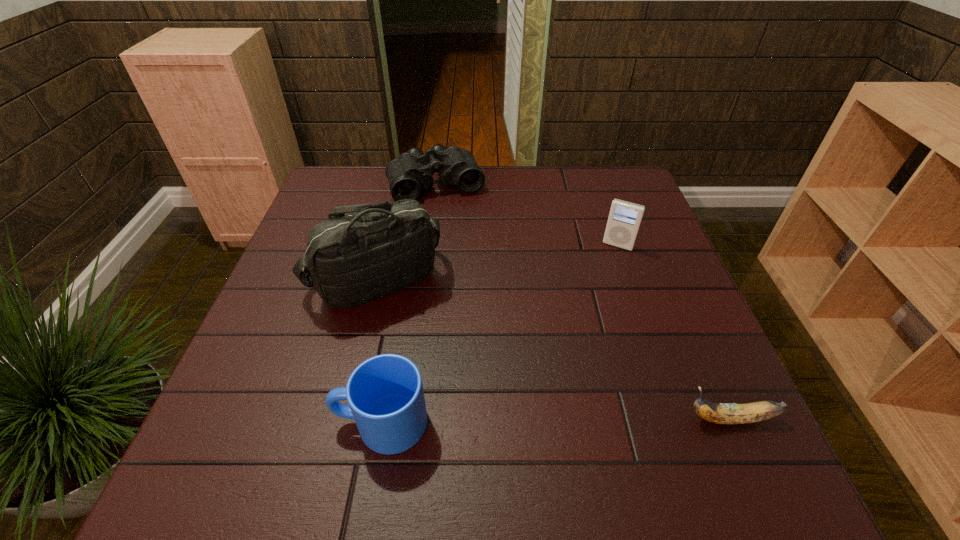
Find the location of a particular element. The image size is (960, 540). mug is located at coordinates (385, 394).

Find the location of a particular element. the shortest object is located at coordinates (720, 413).

The width and height of the screenshot is (960, 540). I want to click on iPod, so click(624, 220).

The height and width of the screenshot is (540, 960). I want to click on the tallest object, so click(363, 252).

Locate an element on the screen. The image size is (960, 540). binoculars is located at coordinates (409, 174).

The image size is (960, 540). Identify the location of vacant space located on the side of the mug with the handle. (214, 422).

Find the location of a particular element. This screenshot has height=540, width=960. free spot located 0.120m on the side of the mug with the handle is located at coordinates (269, 422).

Find the location of `free space located on the side of the mug with the handle`. free space located on the side of the mug with the handle is located at coordinates (219, 422).

At what (x,y) coordinates should I click in order to perform the action: click on vacant space situated 0.390m at the stem of the shortest object. Please return your answer as a coordinate pair (x, y). This screenshot has height=540, width=960. Looking at the image, I should click on (470, 419).

Identify the location of vacant region located 0.210m at the stem of the shortest object. (569, 419).